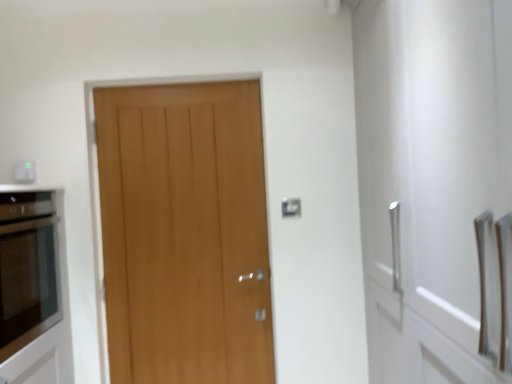
Question: Is white plastic electric outlet at upper left outside matte glass oven at left?

Choices:
 (A) no
 (B) yes

Answer: (B)

Question: Does white plastic electric outlet at upper left have a lesser height compared to matte glass oven at left?

Choices:
 (A) yes
 (B) no

Answer: (A)

Question: Considering the relative sizes of white plastic electric outlet at upper left and matte glass oven at left in the image provided, is white plastic electric outlet at upper left wider than matte glass oven at left?

Choices:
 (A) no
 (B) yes

Answer: (A)

Question: From the image's perspective, is white plastic electric outlet at upper left on matte glass oven at left?

Choices:
 (A) no
 (B) yes

Answer: (B)

Question: Considering the relative positions of white plastic electric outlet at upper left and matte glass oven at left in the image provided, is white plastic electric outlet at upper left to the left of matte glass oven at left from the viewer's perspective?

Choices:
 (A) yes
 (B) no

Answer: (A)

Question: From a real-world perspective, is matte glass oven at left physically located above or below wooden door at center?

Choices:
 (A) below
 (B) above

Answer: (A)

Question: In the image, is matte glass oven at left on the left side or the right side of wooden door at center?

Choices:
 (A) left
 (B) right

Answer: (A)

Question: Considering the positions of matte glass oven at left and wooden door at center in the image, is matte glass oven at left bigger or smaller than wooden door at center?

Choices:
 (A) big
 (B) small

Answer: (A)

Question: From the image's perspective, is matte glass oven at left located above or below wooden door at center?

Choices:
 (A) above
 (B) below

Answer: (B)

Question: Is white plastic electric outlet at upper left inside or outside of wooden door at center?

Choices:
 (A) outside
 (B) inside

Answer: (A)

Question: From a real-world perspective, is white plastic electric outlet at upper left physically located above or below wooden door at center?

Choices:
 (A) above
 (B) below

Answer: (A)

Question: Does point (25, 167) appear closer or farther from the camera than point (180, 342)?

Choices:
 (A) farther
 (B) closer

Answer: (B)

Question: Looking at their shapes, would you say white plastic electric outlet at upper left is wider or thinner than wooden door at center?

Choices:
 (A) wide
 (B) thin

Answer: (B)

Question: Relative to matte glass oven at left, is wooden door at center in front or behind?

Choices:
 (A) front
 (B) behind

Answer: (B)

Question: Considering the positions of wooden door at center and matte glass oven at left in the image, is wooden door at center bigger or smaller than matte glass oven at left?

Choices:
 (A) big
 (B) small

Answer: (B)